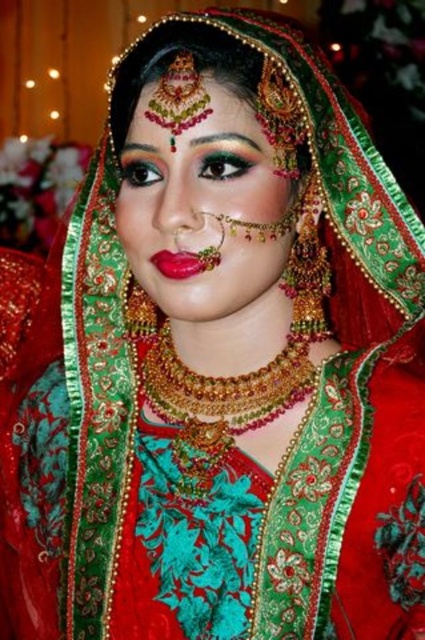
Question: Does matte gold jewelry at center have a smaller size compared to shiny red lipstick at center?

Choices:
 (A) yes
 (B) no

Answer: (B)

Question: Is matte gold jewelry at center thinner than shiny red lipstick at center?

Choices:
 (A) yes
 (B) no

Answer: (B)

Question: Considering the relative positions of matte gold jewelry at center and shiny red lipstick at center in the image provided, where is matte gold jewelry at center located with respect to shiny red lipstick at center?

Choices:
 (A) right
 (B) left

Answer: (A)

Question: Which of the following is the closest to the observer?

Choices:
 (A) (234, 196)
 (B) (186, 275)

Answer: (A)

Question: Which object appears farthest from the camera in this image?

Choices:
 (A) matte gold jewelry at center
 (B) shiny red lipstick at center

Answer: (B)